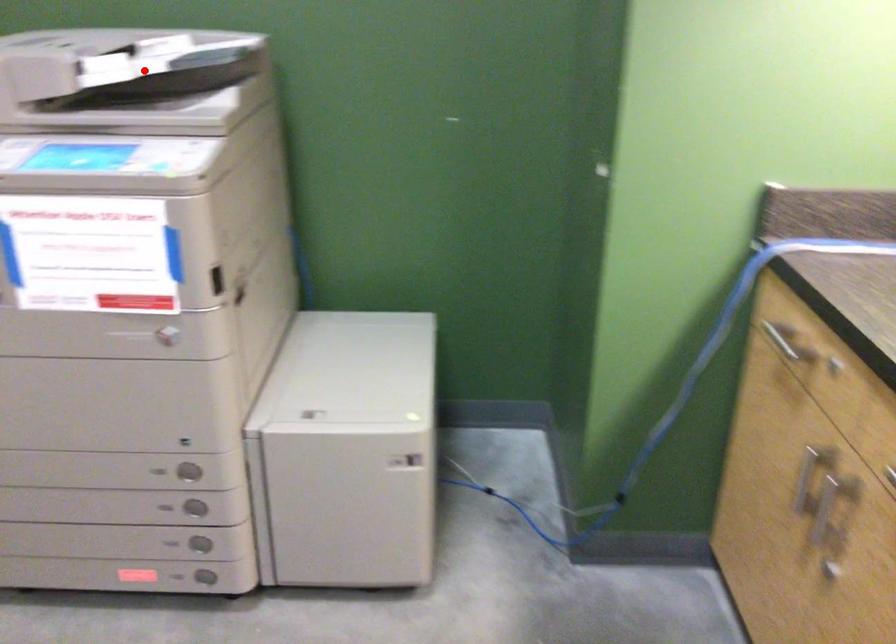
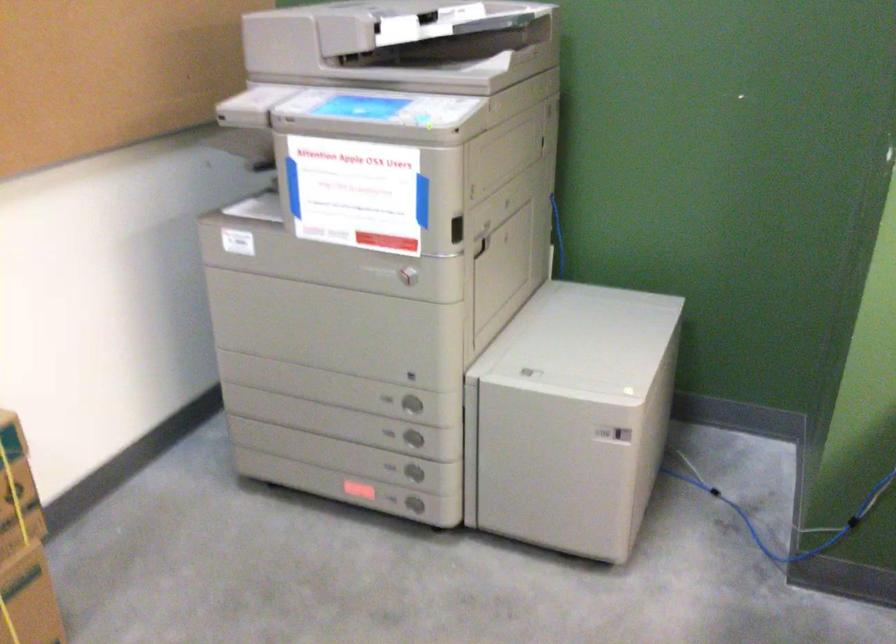
The point at the highlighted location is marked in the first image. Where is the corresponding point in the second image?

(424, 28)